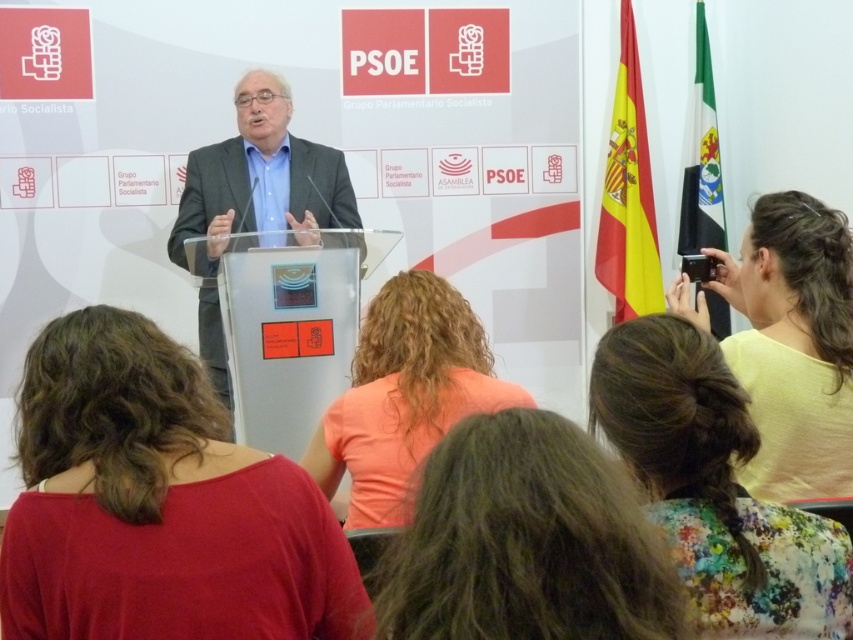
In the scene shown: You are attending a political event and see two attendees dressed in a floral fabric dress at lower right and a dark gray suit at center. Which one is located more to the right side?

The floral fabric dress at lower right is more to the right side than the dark gray suit at center.

You are a photographer at the event. You want to take a photo of the point at coordinate point (704, 552). The camera you are using has a minimum focus distance of 1.0 meters. Will the camera be able to focus on the point?

The point at coordinate point (704, 552) is 1.07 meters from the camera, which is beyond the minimum focus distance of 1.0 meters. Therefore, the camera should be able to focus on the point.

You are attending a political event and notice two items in the scene. The first is a matte red shirt at lower left, and the second is a light yellow fabric at right. Which of these two items takes up more visual space in the image?

The light yellow fabric at right takes up more visual space than the matte red shirt at lower left.